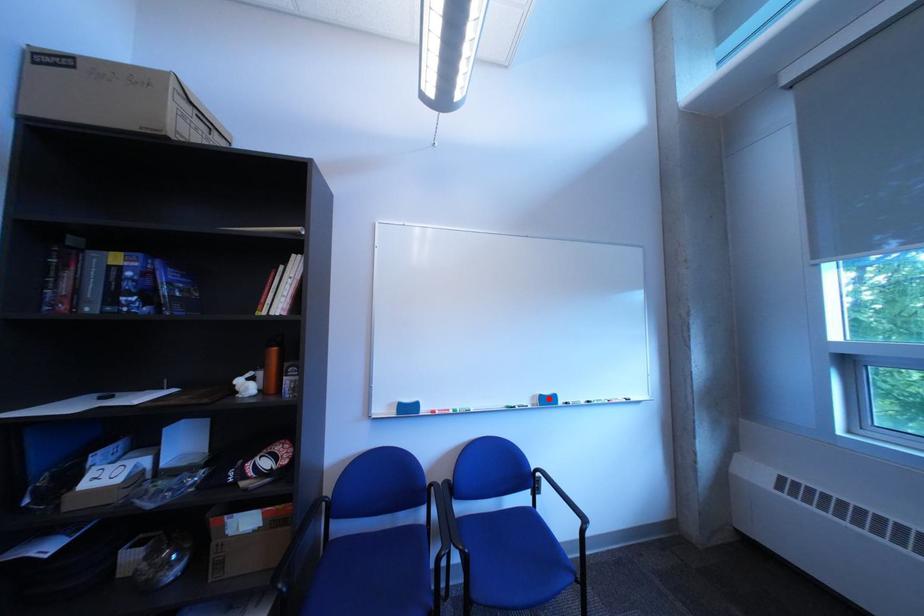
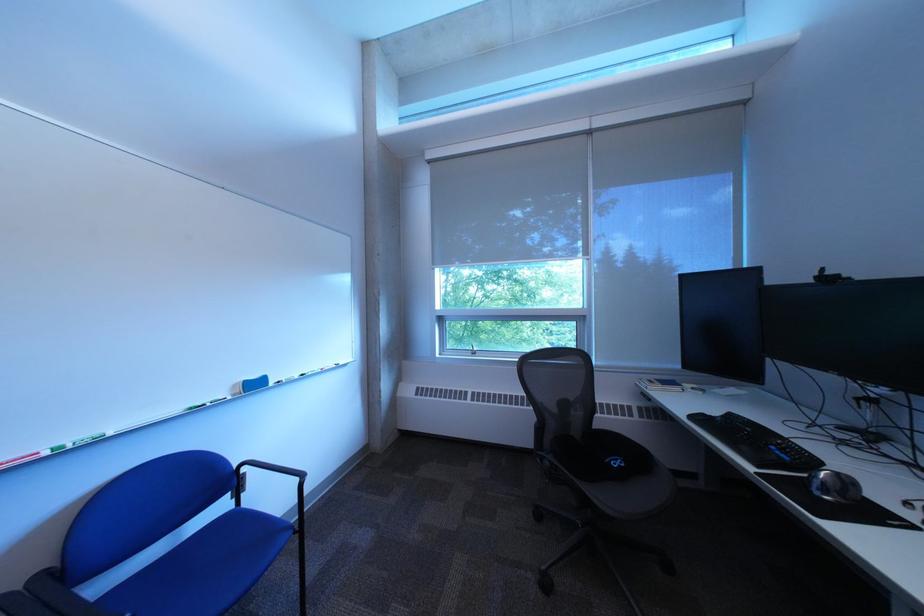
Find the pixel in the second image that matches the highlighted location in the first image.

(249, 387)